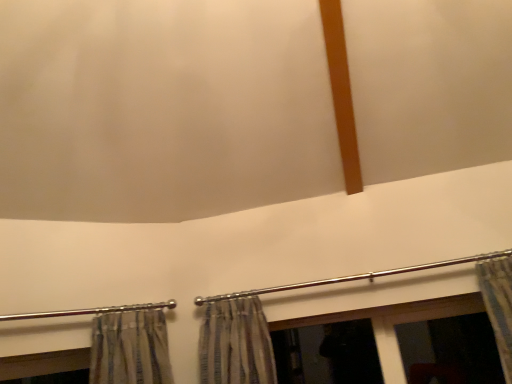
Question: Considering the positions of point (73, 311) and point (226, 296), is point (73, 311) closer or farther from the camera than point (226, 296)?

Choices:
 (A) closer
 (B) farther

Answer: (A)

Question: From the image's perspective, is polished metal rod at lower left, placed as the 2th clothesline when sorted from right to left, above or below polished metal rod at center, marked as the first clothesline in a right-to-left arrangement?

Choices:
 (A) below
 (B) above

Answer: (A)

Question: From a real-world perspective, is polished metal rod at lower left, placed as the 2th clothesline when sorted from right to left, above or below polished metal rod at center, placed as the second clothesline when sorted from left to right?

Choices:
 (A) below
 (B) above

Answer: (A)

Question: Considering the relative positions of polished metal rod at center, placed as the second clothesline when sorted from left to right, and polished metal rod at lower left, placed as the 2th clothesline when sorted from right to left, in the image provided, is polished metal rod at center, placed as the second clothesline when sorted from left to right, to the left or to the right of polished metal rod at lower left, placed as the 2th clothesline when sorted from right to left,?

Choices:
 (A) right
 (B) left

Answer: (A)

Question: Is polished metal rod at center, placed as the second clothesline when sorted from left to right, wider or thinner than polished metal rod at lower left, which is the first clothesline from left to right?

Choices:
 (A) thin
 (B) wide

Answer: (A)

Question: Considering the positions of point (507, 256) and point (159, 304), is point (507, 256) closer or farther from the camera than point (159, 304)?

Choices:
 (A) closer
 (B) farther

Answer: (A)

Question: From a real-world perspective, is polished metal rod at center, marked as the first clothesline in a right-to-left arrangement, above or below polished metal rod at lower left, placed as the 2th clothesline when sorted from right to left?

Choices:
 (A) below
 (B) above

Answer: (B)